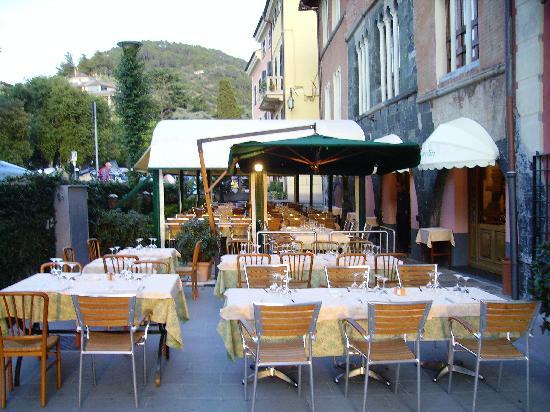
The image size is (550, 412). I want to click on tables, so click(x=79, y=285), click(x=133, y=252), click(x=306, y=313), click(x=323, y=265), click(x=309, y=228).